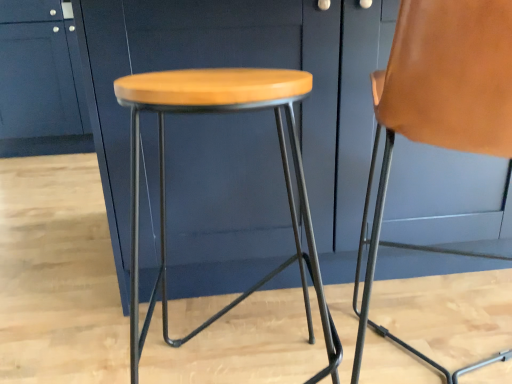
Question: Is wooden seat stool at center outside of matte blue cabinet at upper left, positioned as the first cabinetry in back-to-front order?

Choices:
 (A) yes
 (B) no

Answer: (A)

Question: Does wooden seat stool at center lie in front of matte blue cabinet at upper left, which is the 2th cabinetry in right-to-left order?

Choices:
 (A) no
 (B) yes

Answer: (B)

Question: Is wooden seat stool at center wider than matte blue cabinet at upper left, which is the 2th cabinetry in right-to-left order?

Choices:
 (A) yes
 (B) no

Answer: (B)

Question: Is wooden seat stool at center directly adjacent to matte blue cabinet at upper left, the first cabinetry when ordered from left to right?

Choices:
 (A) no
 (B) yes

Answer: (A)

Question: From the image's perspective, is wooden seat stool at center located beneath matte blue cabinet at upper left, the first cabinetry when ordered from left to right?

Choices:
 (A) no
 (B) yes

Answer: (B)

Question: From a real-world perspective, is wooden seat stool at center beneath matte blue cabinet at upper left, positioned as the first cabinetry in back-to-front order?

Choices:
 (A) yes
 (B) no

Answer: (A)

Question: Is brown leather chair at right not close to matte blue cabinet at upper left, the first cabinetry when ordered from left to right?

Choices:
 (A) yes
 (B) no

Answer: (A)

Question: Is brown leather chair at right wider than matte blue cabinet at upper left, which is the 2th cabinetry in right-to-left order?

Choices:
 (A) yes
 (B) no

Answer: (B)

Question: From a real-world perspective, is brown leather chair at right located higher than matte blue cabinet at upper left, positioned as the first cabinetry in back-to-front order?

Choices:
 (A) no
 (B) yes

Answer: (A)

Question: Is brown leather chair at right shorter than matte blue cabinet at upper left, which appears as the 2th cabinetry when viewed from the front?

Choices:
 (A) no
 (B) yes

Answer: (B)

Question: From a real-world perspective, is brown leather chair at right under matte blue cabinet at upper left, the first cabinetry when ordered from left to right?

Choices:
 (A) no
 (B) yes

Answer: (B)

Question: Can you confirm if brown leather chair at right is taller than matte blue cabinet at upper left, which appears as the 2th cabinetry when viewed from the front?

Choices:
 (A) yes
 (B) no

Answer: (B)

Question: Would you consider wooden seat stool at center to be distant from brown leather chair at right?

Choices:
 (A) no
 (B) yes

Answer: (A)